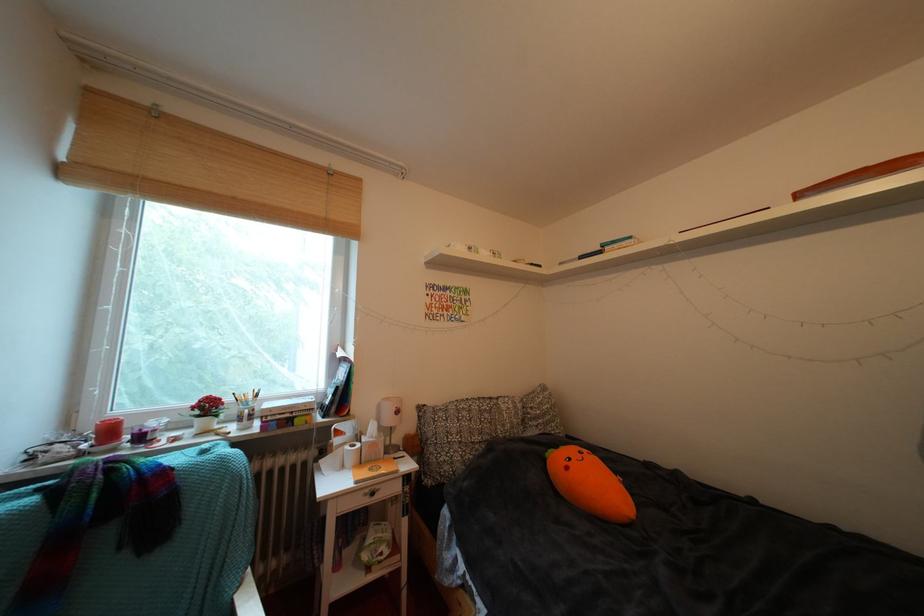
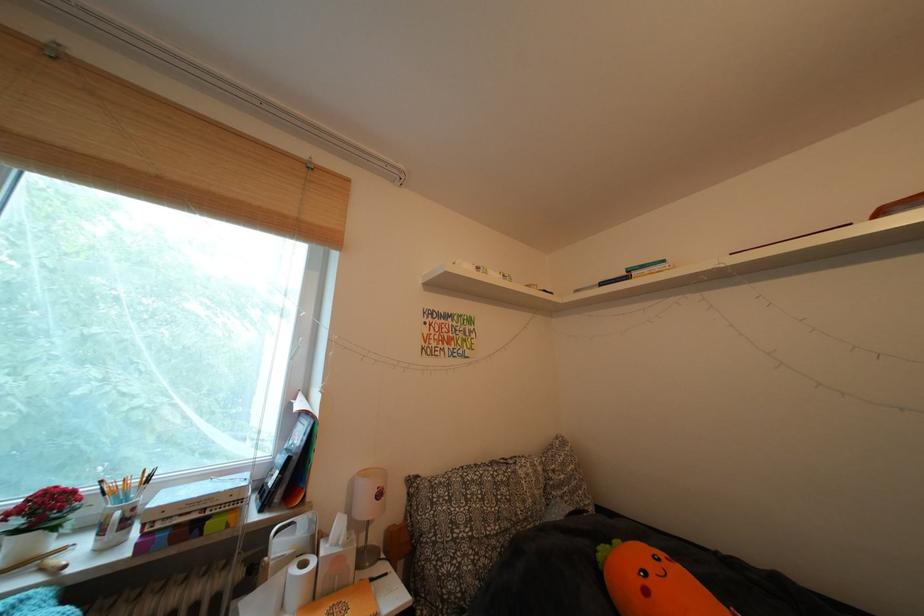
In the second image, find the point that corresponds to point 360,466 in the first image.

(306, 602)